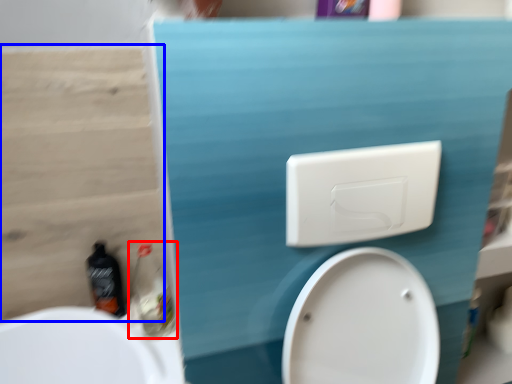
Question: Which of the following is the farthest to the observer, cleaning product (highlighted by a red box) or plywood (highlighted by a blue box)?

Choices:
 (A) cleaning product
 (B) plywood

Answer: (A)